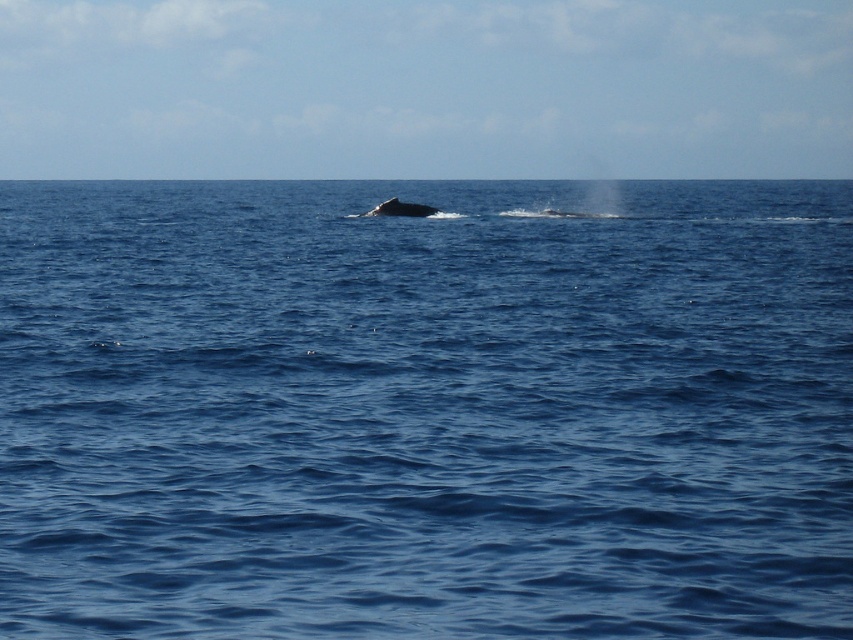
Is blue water at center to the right of gray matte whale at center from the viewer's perspective?

No, blue water at center is not to the right of gray matte whale at center.

Who is higher up, blue water at center or gray matte whale at center?

blue water at center is higher up.

Which is behind, point (172, 362) or point (381, 204)?

Positioned behind is point (381, 204).

Find the location of a particular element. blue water at center is located at coordinates (425, 410).